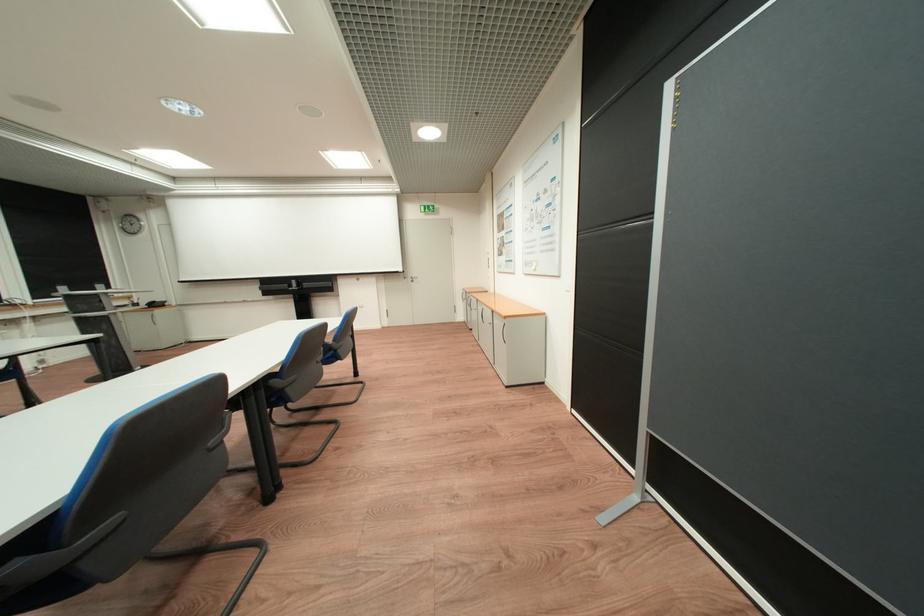
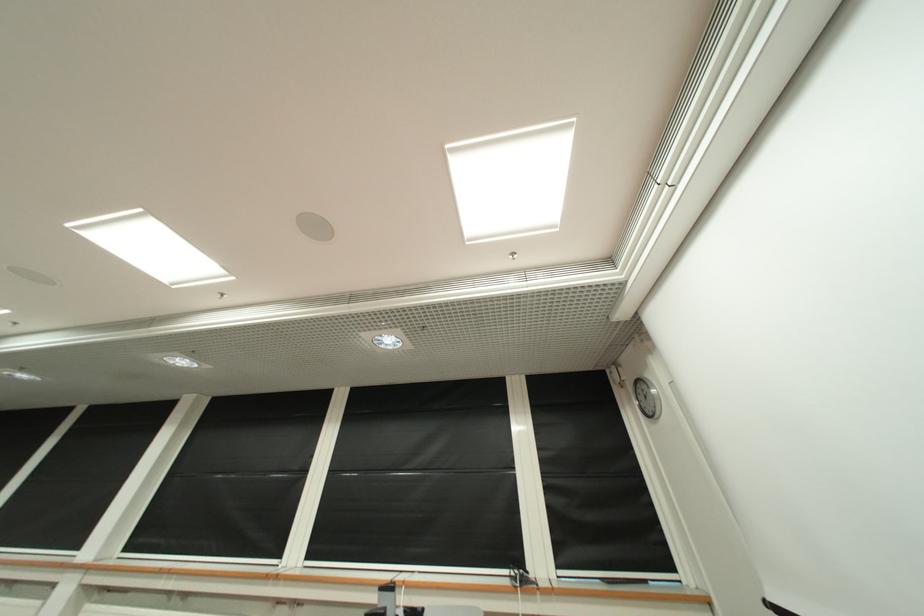
Where in the second image is the point corresponding to [122,223] from the first image?

(642, 402)